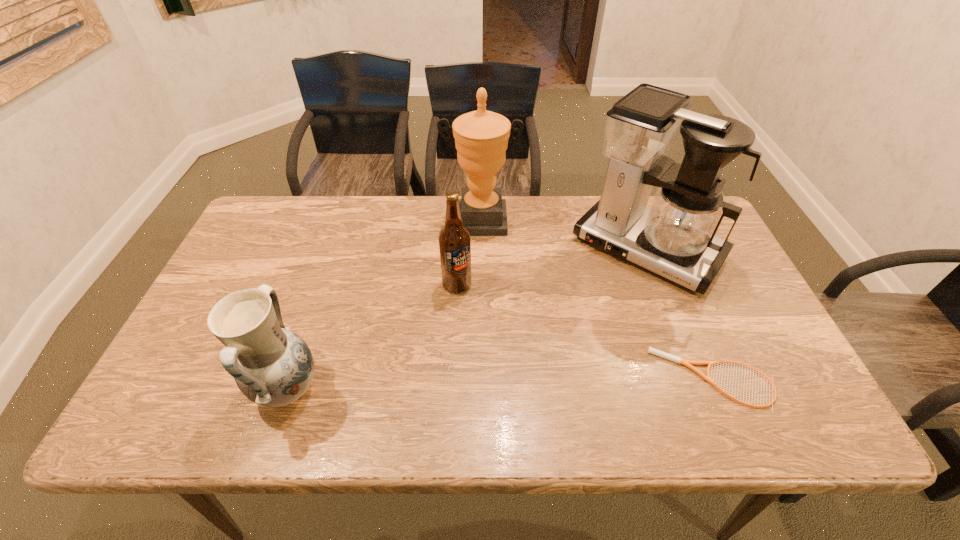
Locate an element on the screen. This screenshot has width=960, height=540. tennis racket that is at the right edge is located at coordinates (687, 363).

Locate an element on the screen. Image resolution: width=960 pixels, height=540 pixels. coffee maker situated at the right edge is located at coordinates (675, 238).

Find the location of `object present at the far right corner`. object present at the far right corner is located at coordinates (675, 238).

I want to click on object at the near right corner, so click(687, 363).

Image resolution: width=960 pixels, height=540 pixels. In order to click on vacant area at the far edge in this screenshot , I will do `click(439, 195)`.

Locate an element on the screen. This screenshot has height=540, width=960. vacant space at the near edge of the desktop is located at coordinates (634, 380).

In the image, there is a desktop. What are the coordinates of `vacant space at the left edge` in the screenshot? It's located at (252, 268).

The width and height of the screenshot is (960, 540). I want to click on blank space at the right edge of the desktop, so click(732, 323).

I want to click on vacant area at the far right corner of the desktop, so click(x=650, y=199).

The image size is (960, 540). In the image, there is a desktop. In order to click on free space at the near right corner in this screenshot , I will do `click(740, 369)`.